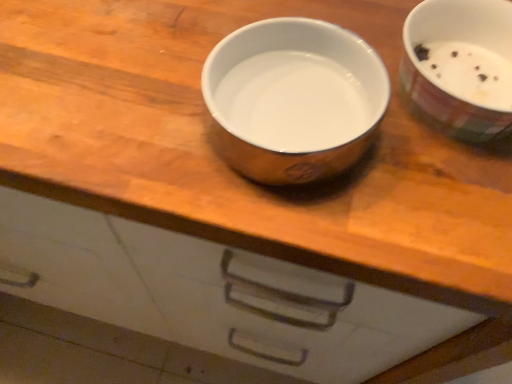
Identify the location of free space to the left of satin silver bowl at center, marked as the 1th tableware in a left-to-right arrangement. (117, 100).